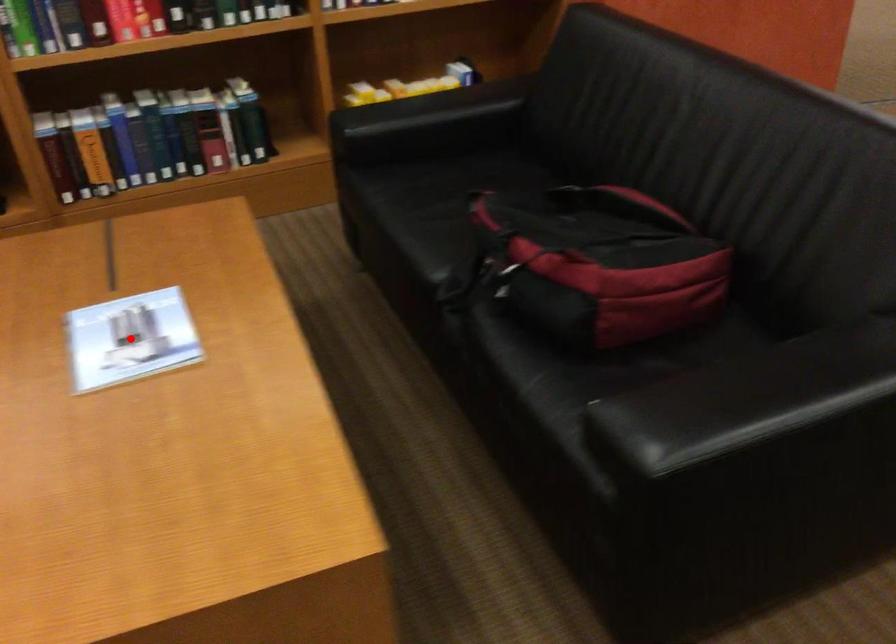
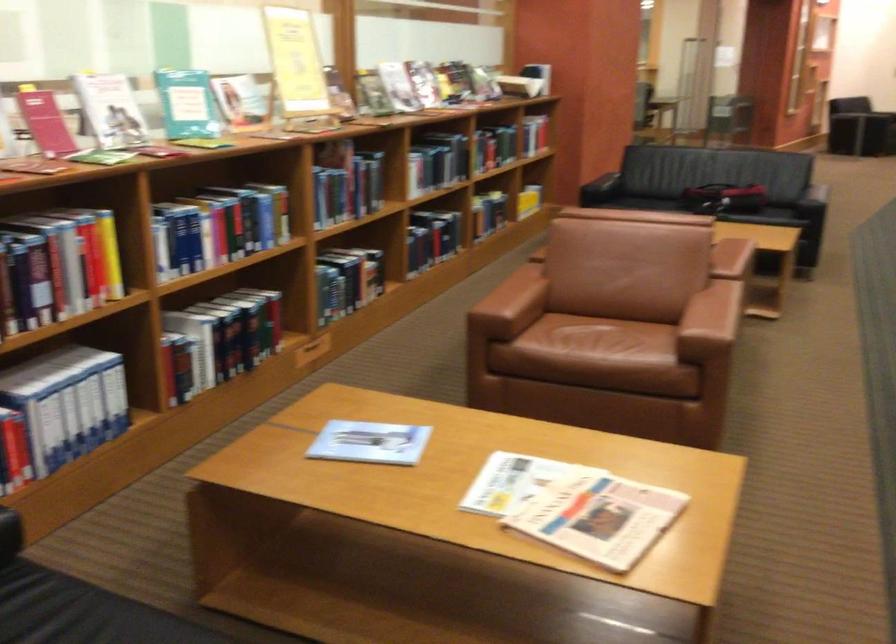
Question: I am providing you with two images of the same scene from different viewpoints. A red point is marked on the first image. Is the red point's position out of view in image 2?

Choices:
 (A) Yes
 (B) No

Answer: (A)